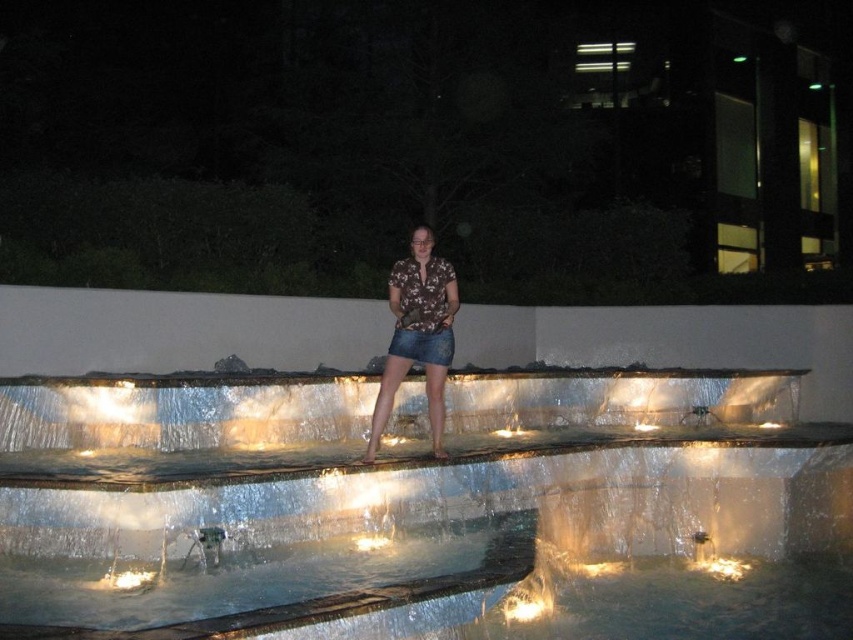
Question: Is clear glass water at center to the left of brown floral shirt at center from the viewer's perspective?

Choices:
 (A) no
 (B) yes

Answer: (A)

Question: Can you confirm if brown floral shirt at center is positioned above denim skirt at center?

Choices:
 (A) yes
 (B) no

Answer: (A)

Question: From the image, what is the correct spatial relationship of clear glass water at center in relation to brown floral shirt at center?

Choices:
 (A) below
 (B) above

Answer: (A)

Question: Which point is farther from the camera taking this photo?

Choices:
 (A) (424, 336)
 (B) (595, 376)
 (C) (431, 435)

Answer: (B)

Question: Which point is farther to the camera?

Choices:
 (A) brown floral shirt at center
 (B) denim skirt at center

Answer: (B)

Question: Which object appears closest to the camera in this image?

Choices:
 (A) clear glass water at center
 (B) denim skirt at center
 (C) brown floral shirt at center

Answer: (A)